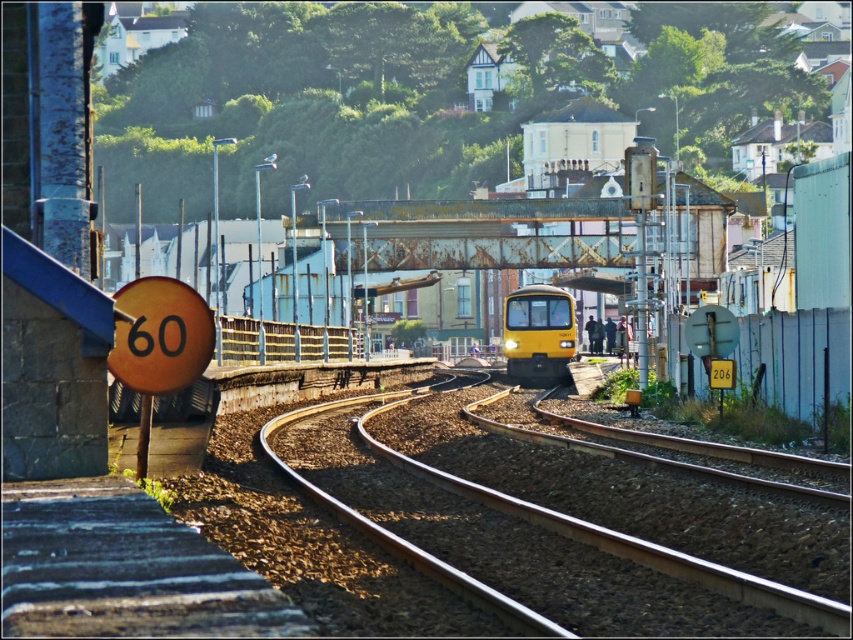
Measure the distance from metallic tracks at center to yellow matte train at center.

79.59 feet

Is point (492, 490) positioned after point (567, 326)?

That is False.

At what (x,y) coordinates should I click in order to perform the action: click on metallic tracks at center. Please return your answer as a coordinate pair (x, y). This screenshot has width=853, height=640. Looking at the image, I should click on (570, 536).